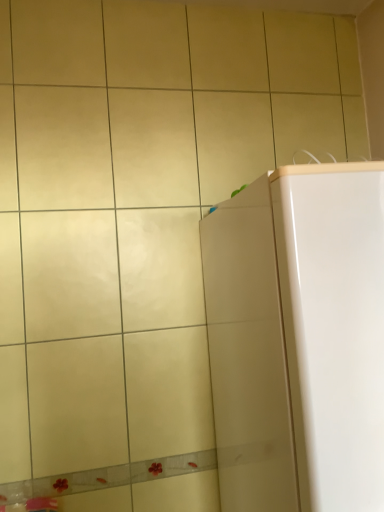
At what (x,y) coordinates should I click in order to perform the action: click on white glossy refrigerator at right. Please return your answer as a coordinate pair (x, y). The width and height of the screenshot is (384, 512). Looking at the image, I should click on (298, 339).

This screenshot has height=512, width=384. What do you see at coordinates (298, 339) in the screenshot?
I see `white glossy refrigerator at right` at bounding box center [298, 339].

Looking at this image, in order to face white glossy refrigerator at right, should I rotate leftwards or rightwards?

To face it directly, rotate right by 21.261 degrees.

Locate an element on the screen. white glossy refrigerator at right is located at coordinates (298, 339).